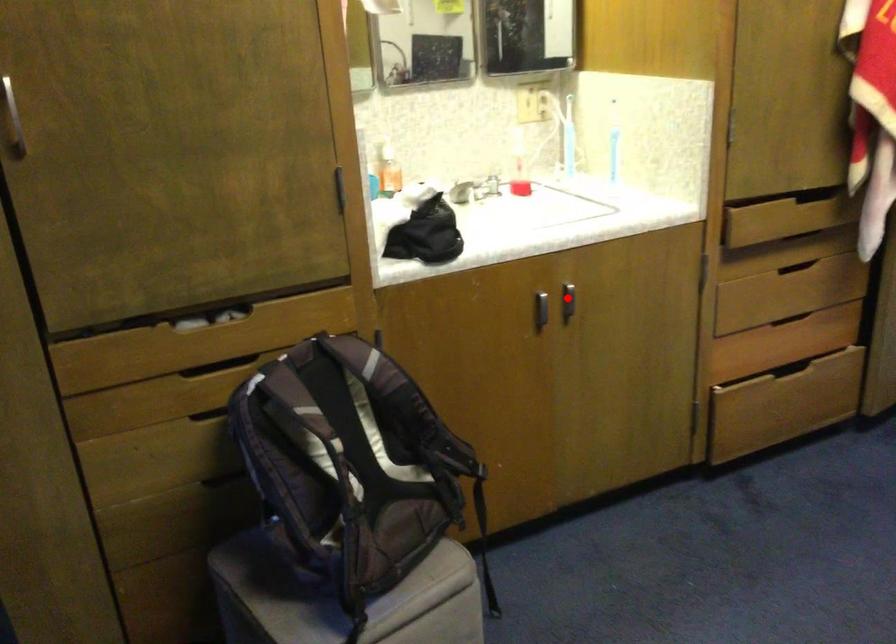
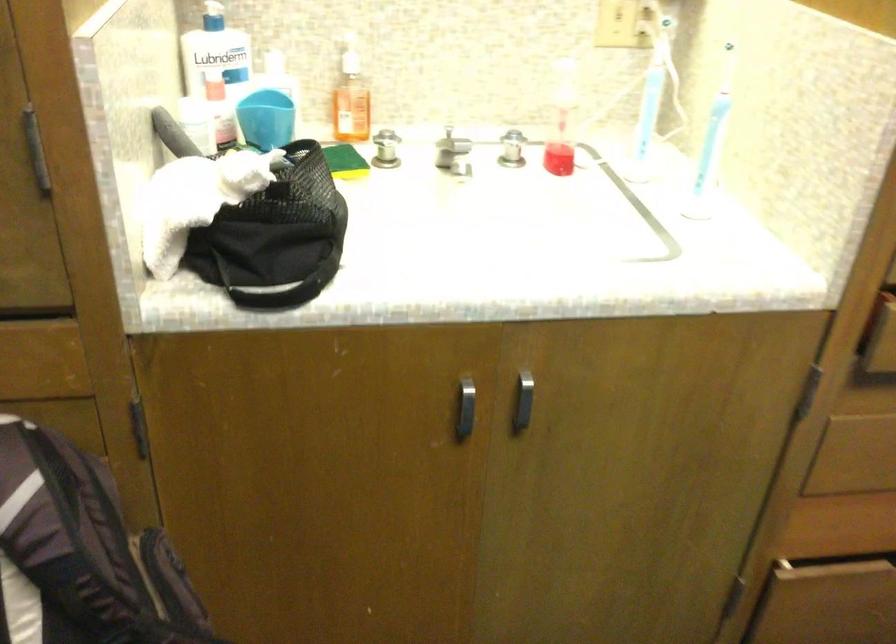
Question: A red point is marked in image1. In image2, is the corresponding 3D point closer to the camera or farther? Reply with the corresponding letter.

Choices:
 (A) The corresponding 3D point is closer.
 (B) The corresponding 3D point is farther.

Answer: (A)